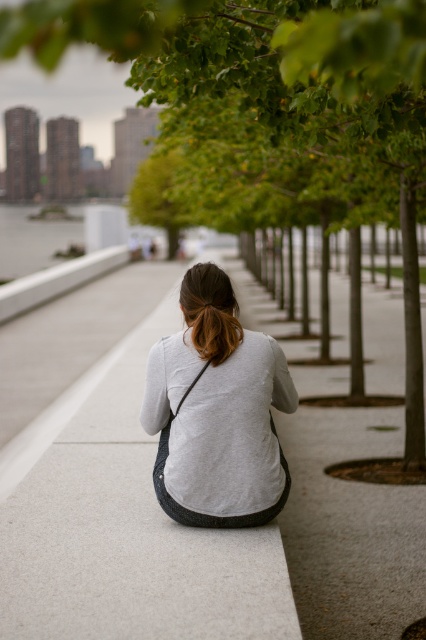
From the picture: You are a photographer standing at the edge of the pathway. You want to capture a photo where the smooth concrete bench at center and the gray cotton shirt at center are both visible. Which object will appear taller in the photo?

The smooth concrete bench at center will appear taller in the photo because it has a greater height compared to the gray cotton shirt at center as stated in the description.